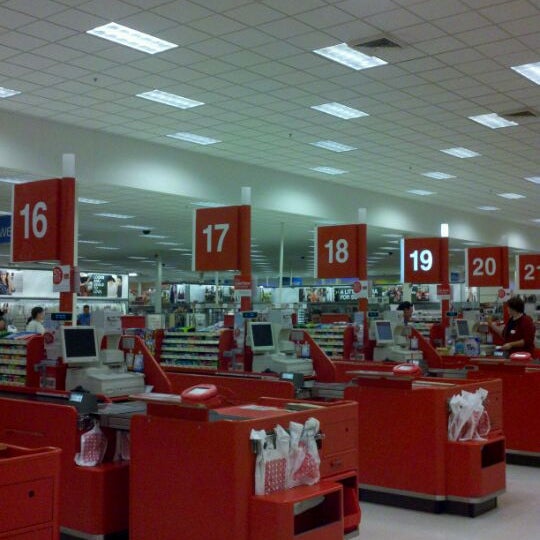
Where is `light`? light is located at coordinates [x=446, y=225].